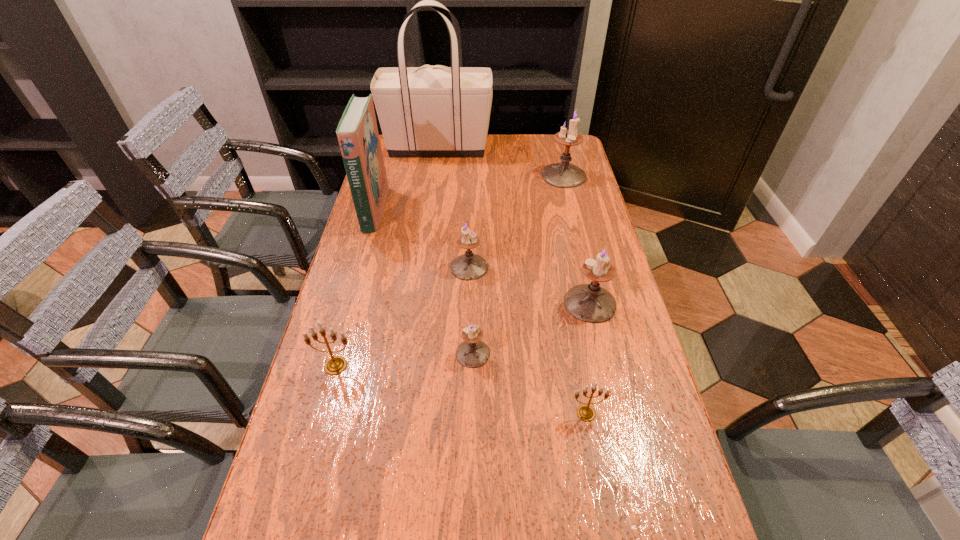
At what (x,y) coordinates should I click in order to perform the action: click on shopping bag. Please return your answer as a coordinate pair (x, y). This screenshot has width=960, height=540. Looking at the image, I should click on (436, 110).

Where is `the tallest object`? The image size is (960, 540). the tallest object is located at coordinates (436, 110).

Image resolution: width=960 pixels, height=540 pixels. What are the coordinates of `the sixth nearest object` in the screenshot? It's located at (357, 132).

Where is `the seventh shortest object`? The image size is (960, 540). the seventh shortest object is located at coordinates (357, 132).

I want to click on the second farthest object, so click(x=563, y=175).

Identify the location of the third tallest object. (563, 175).

At what (x,y) coordinates should I click in order to perform the action: click on the second biggest purple candle holder. Please return your answer as a coordinate pair (x, y). Looking at the image, I should click on (590, 303).

I want to click on the fifth shortest candelabrum, so click(x=590, y=303).

Locate an element on the screen. Image resolution: width=960 pixels, height=540 pixels. the second farthest candelabrum is located at coordinates (469, 266).

Where is `the second smallest purple candle holder`? The width and height of the screenshot is (960, 540). the second smallest purple candle holder is located at coordinates (469, 266).